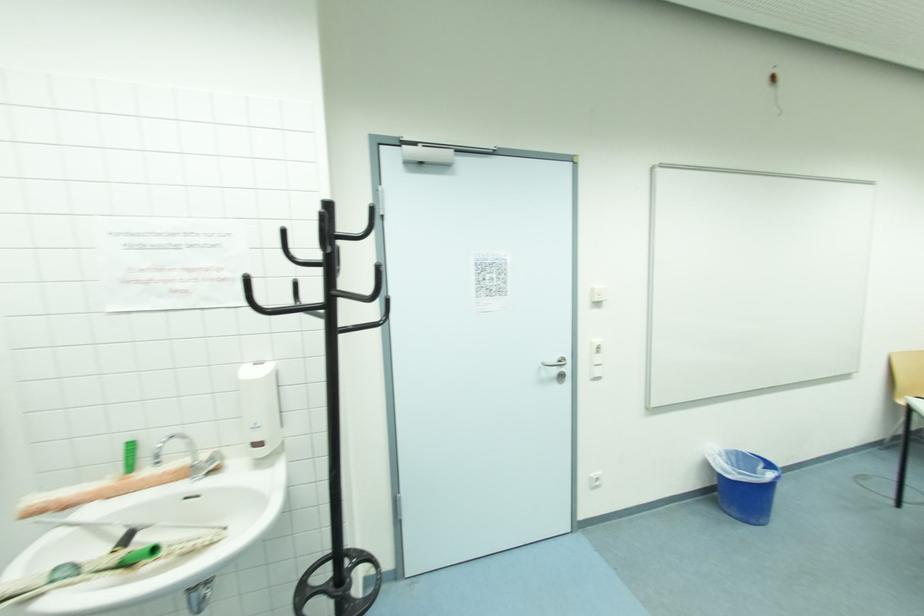
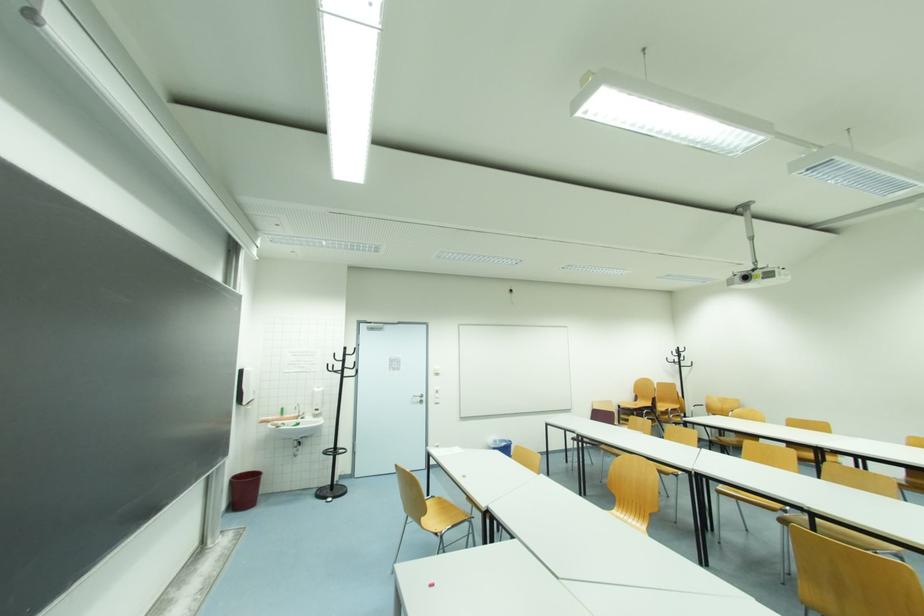
Question: Which direction would the cameraman need to move to produce the second image? Reply with the corresponding letter.

Choices:
 (A) Left
 (B) Right
 (C) Forward
 (D) Backward

Answer: (D)